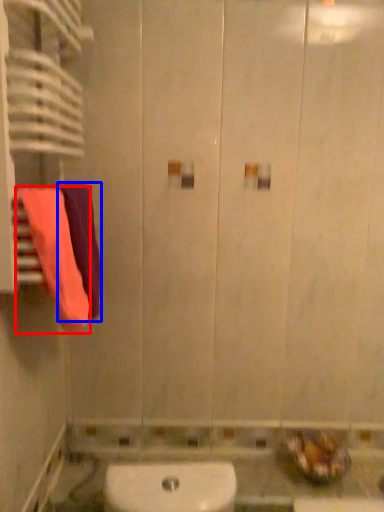
Question: Which of the following is the closest to the observer, towel (highlighted by a red box) or towel (highlighted by a blue box)?

Choices:
 (A) towel
 (B) towel

Answer: (A)